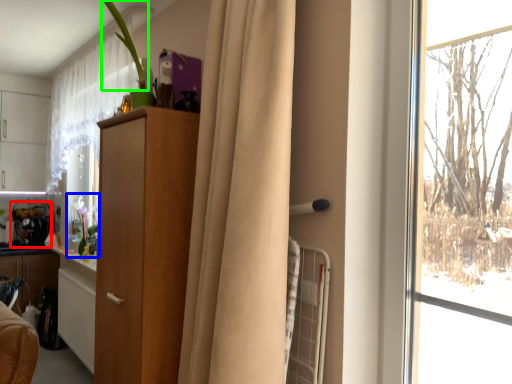
Question: Which object is positioned closest to appliance (highlighted by a red box)? Select from floral arrangement (highlighted by a blue box) and plant (highlighted by a green box).

Choices:
 (A) floral arrangement
 (B) plant

Answer: (A)